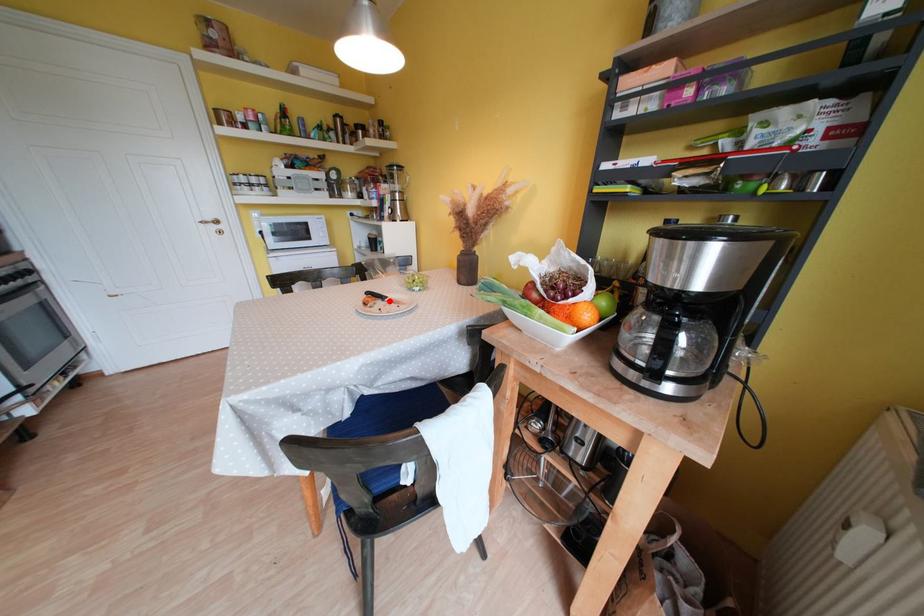
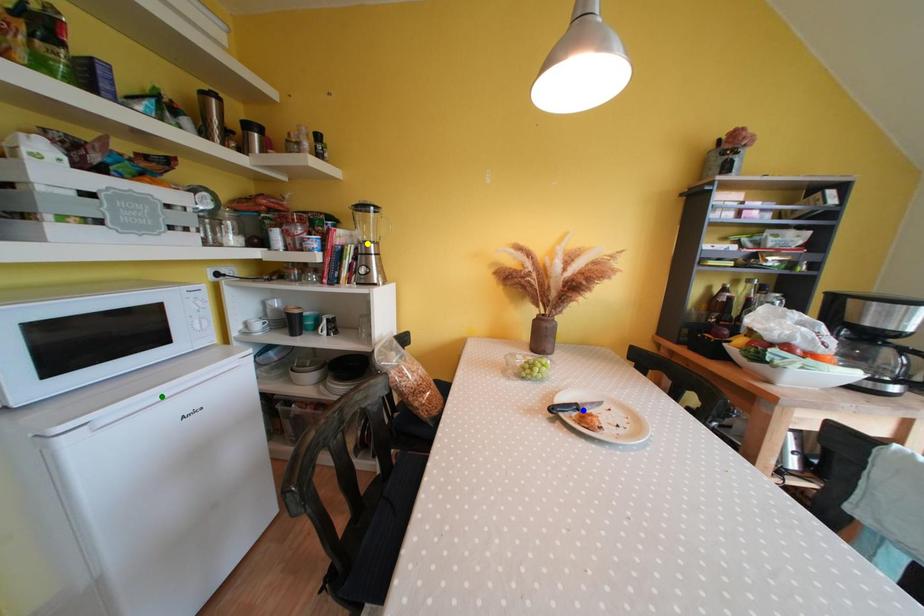
Question: I am providing you with two images of the same scene from different viewpoints. A red point is marked on the first image. You are given multiple points on the second image. Which mark in image 2 goes with the point in image 1?

Choices:
 (A) blue point
 (B) yellow point
 (C) green point

Answer: (A)